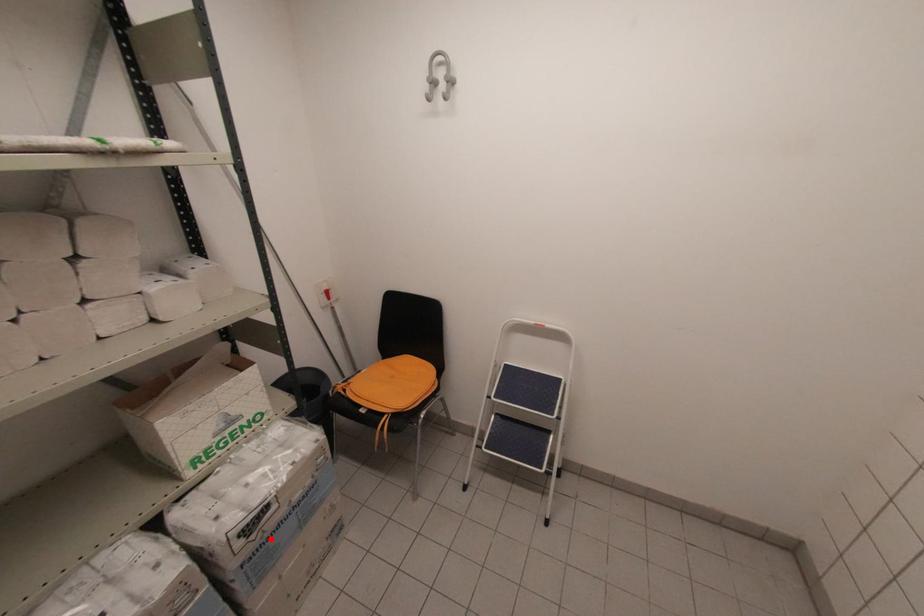
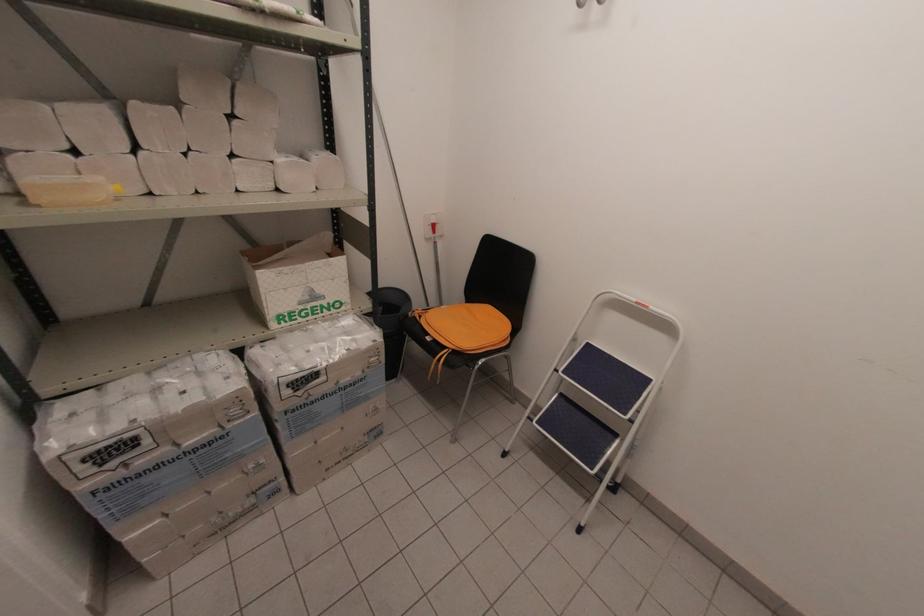
Question: I am providing you with two images of the same scene from different viewpoints. A red point is marked on the first image. Is the red point's position out of view in image 2?

Choices:
 (A) Yes
 (B) No

Answer: (B)